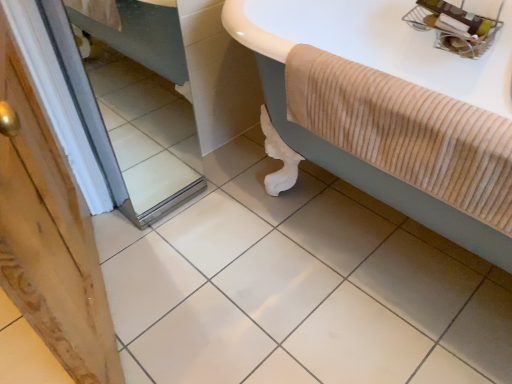
Where is `vacant area situated below mirror at left (from a real-world perspective)`? The image size is (512, 384). vacant area situated below mirror at left (from a real-world perspective) is located at coordinates (168, 197).